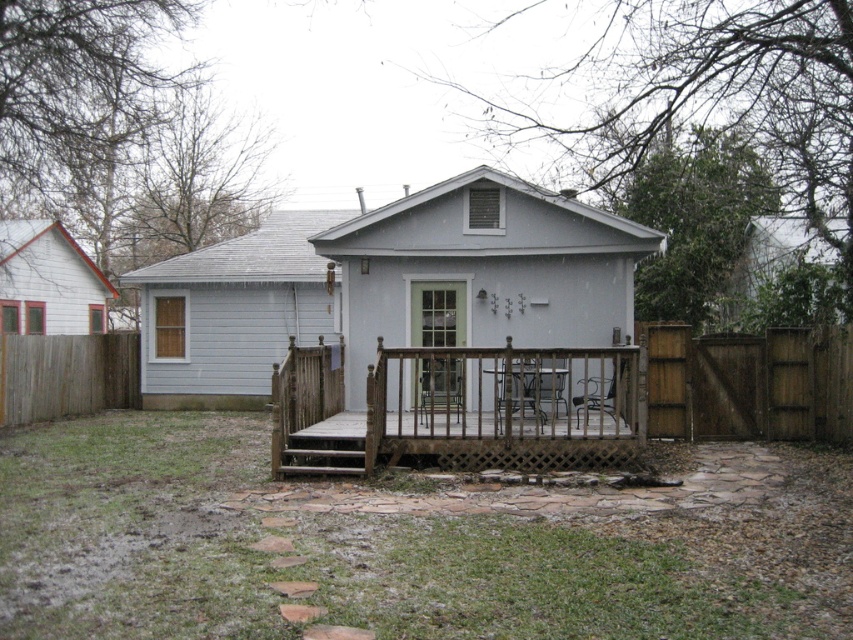
Is green grass at center above brown wooden gate at right?

No, green grass at center is not above brown wooden gate at right.

The height and width of the screenshot is (640, 853). In order to click on green grass at center in this screenshot , I will do `click(389, 548)`.

Describe the element at coordinates (457, 410) in the screenshot. I see `weathered wood porch at center` at that location.

Who is more distant from viewer, (305, 456) or (120, 340)?

The point (120, 340) is behind.

The height and width of the screenshot is (640, 853). I want to click on weathered wood porch at center, so [x=457, y=410].

Does point (68, 438) come in front of point (340, 428)?

No, it is behind (340, 428).

Who is more distant from viewer, (618, 534) or (315, 378)?

The point (315, 378) is behind.

Is point (550, 586) less distant than point (375, 394)?

Yes, it is.

This screenshot has width=853, height=640. In order to click on green grass at center in this screenshot , I will do `click(389, 548)`.